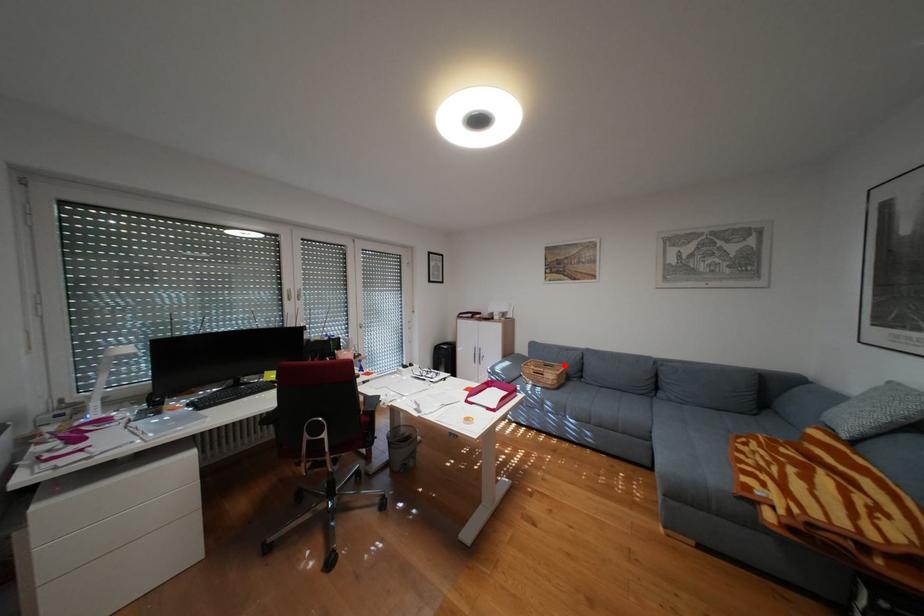
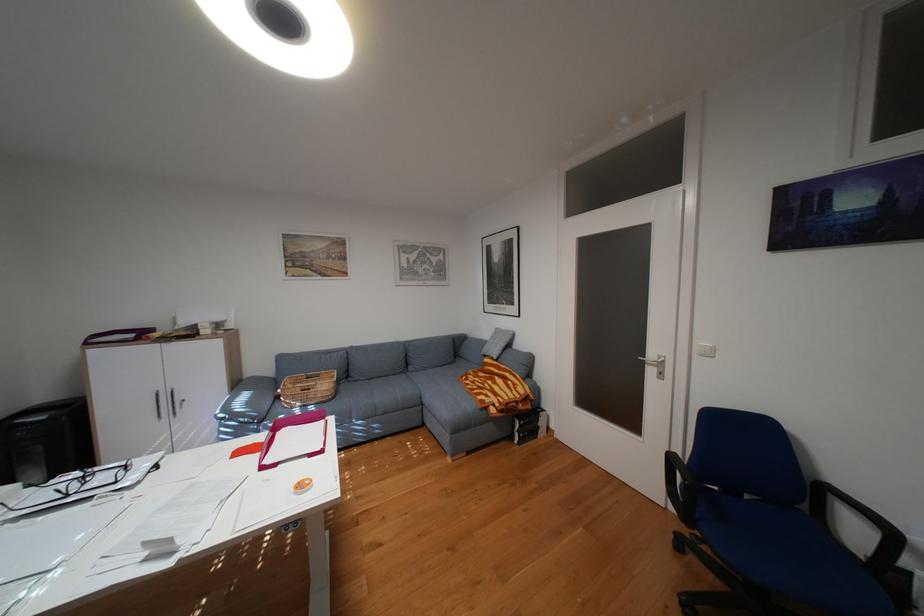
Question: A red point is marked in image1. In image2, is the corresponding 3D point closer to the camera or farther? Reply with the corresponding letter.

Choices:
 (A) The corresponding 3D point is closer.
 (B) The corresponding 3D point is farther.

Answer: (A)